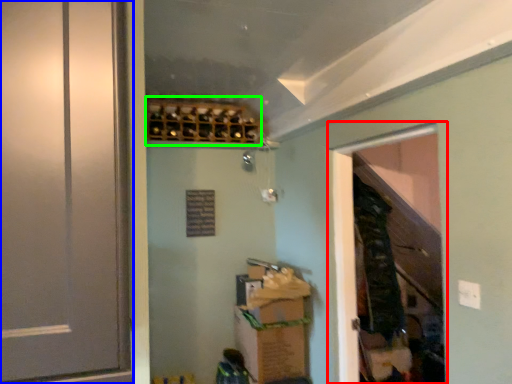
Question: Which object is the closest to the screen door (highlighted by a red box)? Choose among these: door (highlighted by a blue box) or wine rack (highlighted by a green box).

Choices:
 (A) door
 (B) wine rack

Answer: (B)